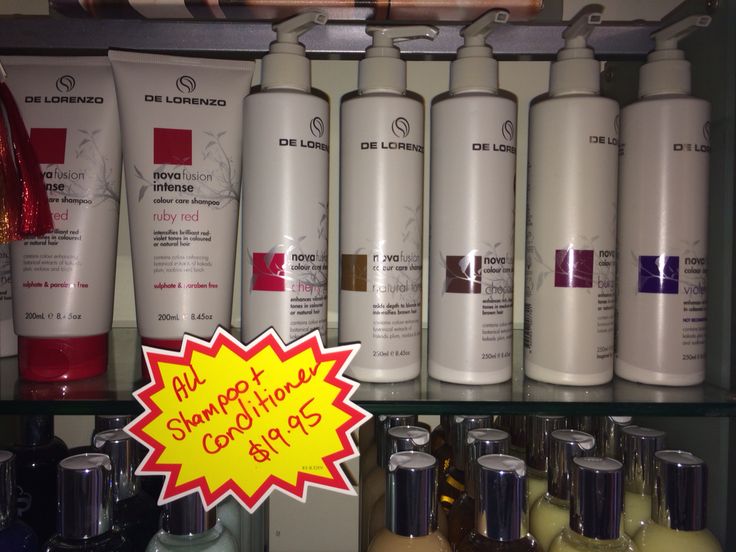
This screenshot has width=736, height=552. Find the location of `white bottles on middle shelves`. white bottles on middle shelves is located at coordinates (49, 284), (198, 247), (308, 238), (400, 259), (470, 266), (578, 274), (665, 269).